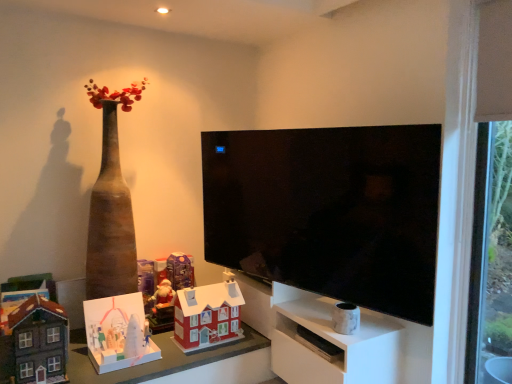
Question: Should I look upward or downward to see white cardboard house at lower left, which is the second toy in left-to-right order?

Choices:
 (A) down
 (B) up

Answer: (A)

Question: From a real-world perspective, is black glossy tv at center below transparent glass door at right?

Choices:
 (A) yes
 (B) no

Answer: (A)

Question: Is black glossy tv at center next to transparent glass door at right?

Choices:
 (A) no
 (B) yes

Answer: (A)

Question: Is the depth of black glossy tv at center greater than that of transparent glass door at right?

Choices:
 (A) no
 (B) yes

Answer: (A)

Question: Considering the relative positions of black glossy tv at center and transparent glass door at right in the image provided, is black glossy tv at center in front of transparent glass door at right?

Choices:
 (A) no
 (B) yes

Answer: (B)

Question: Is black glossy tv at center at the left side of transparent glass door at right?

Choices:
 (A) yes
 (B) no

Answer: (A)

Question: Is black glossy tv at center turned away from transparent glass door at right?

Choices:
 (A) no
 (B) yes

Answer: (B)

Question: From the image's perspective, is black glossy tv at center located above matte gray toy house at lower left, the fifth toy viewed from the right?

Choices:
 (A) yes
 (B) no

Answer: (A)

Question: Is black glossy tv at center bigger than matte gray toy house at lower left, the fifth toy viewed from the right?

Choices:
 (A) yes
 (B) no

Answer: (A)

Question: Is black glossy tv at center oriented away from matte gray toy house at lower left, the 1th toy in the left-to-right sequence?

Choices:
 (A) yes
 (B) no

Answer: (B)

Question: Does black glossy tv at center contain matte gray toy house at lower left, the 1th toy in the left-to-right sequence?

Choices:
 (A) no
 (B) yes

Answer: (A)

Question: Does black glossy tv at center have a lesser width compared to matte gray toy house at lower left, the 1th toy in the left-to-right sequence?

Choices:
 (A) yes
 (B) no

Answer: (A)

Question: From the image's perspective, is black glossy tv at center below matte gray toy house at lower left, the 1th toy in the left-to-right sequence?

Choices:
 (A) no
 (B) yes

Answer: (A)

Question: Is the depth of transparent glass door at right greater than that of matte cardboard table at lower center?

Choices:
 (A) yes
 (B) no

Answer: (B)